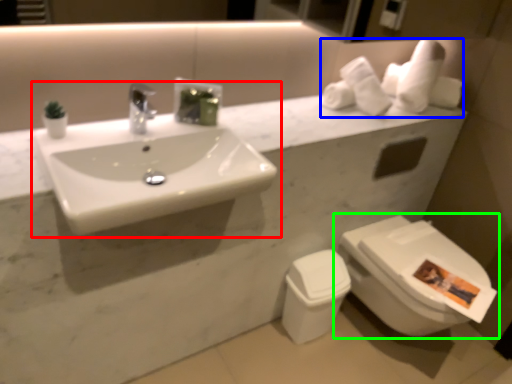
Question: Which object is positioned closest to sink (highlighted by a red box)? Select from toilet paper (highlighted by a blue box) and toilet (highlighted by a green box).

Choices:
 (A) toilet paper
 (B) toilet

Answer: (A)